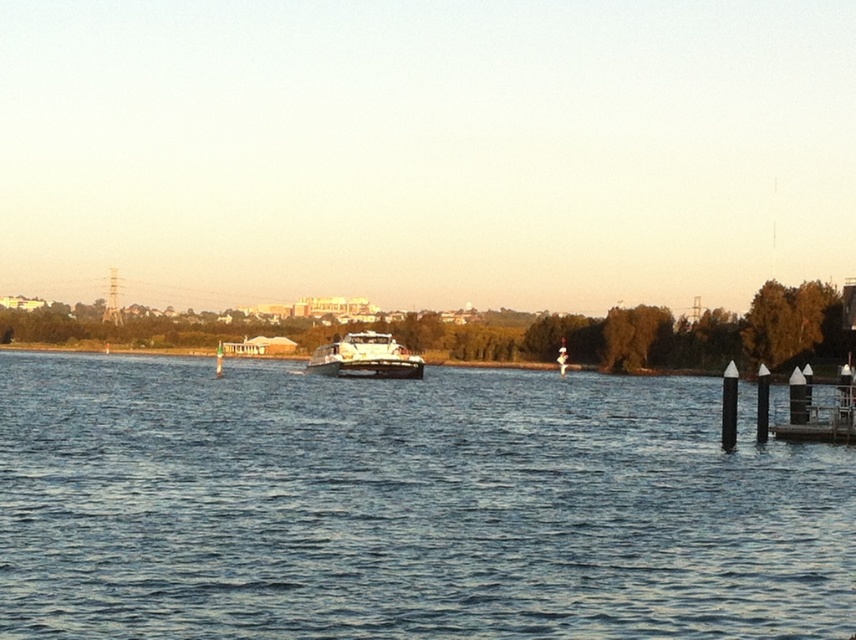
Is blue water at center shorter than white glossy boat at center?

Yes, blue water at center is shorter than white glossy boat at center.

Between point (639, 476) and point (391, 362), which one is positioned in front?

Point (639, 476)

Is point (572, 589) positioned in front of point (357, 333)?

Yes, it is in front of point (357, 333).

At what (x,y) coordinates should I click in order to perform the action: click on blue water at center. Please return your answer as a coordinate pair (x, y). This screenshot has width=856, height=640. Looking at the image, I should click on (406, 506).